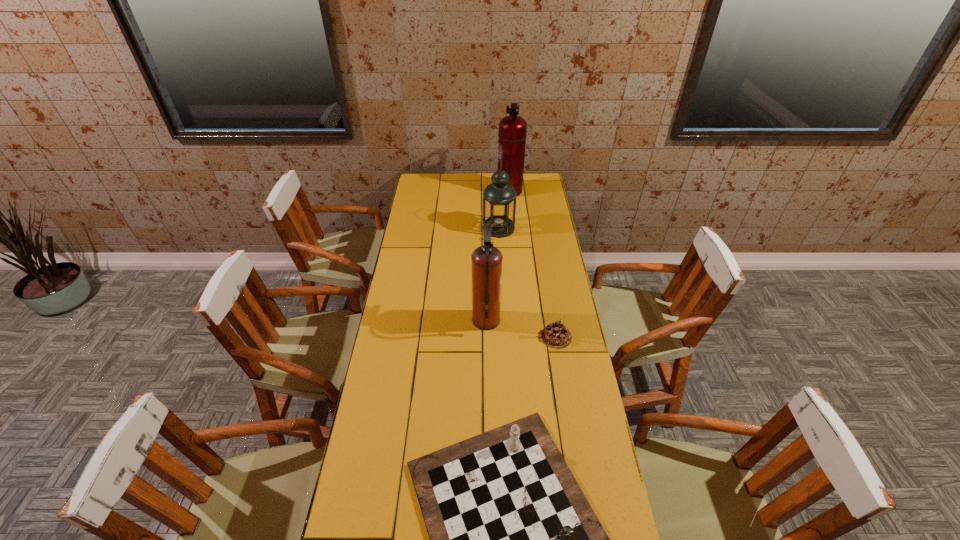
Locate an element on the screen. This screenshot has height=540, width=960. vacant position in the image that satisfies the following two spatial constraints: 1. on the nozzle side of the farthest object; 2. on the left side of the shortest object is located at coordinates (523, 337).